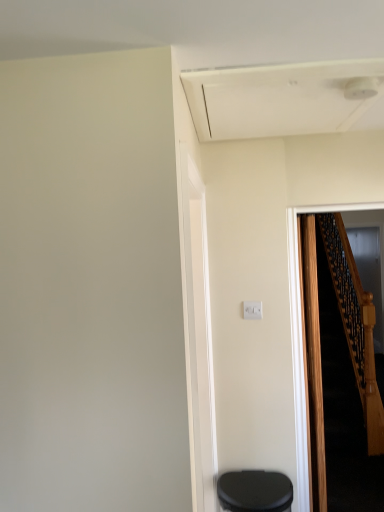
Question: Would you say wooden at right is a long distance from white plastic electric outlet at center?

Choices:
 (A) no
 (B) yes

Answer: (B)

Question: Is wooden at right outside white plastic electric outlet at center?

Choices:
 (A) no
 (B) yes

Answer: (B)

Question: Does wooden at right appear on the right side of white plastic electric outlet at center?

Choices:
 (A) yes
 (B) no

Answer: (A)

Question: Can you confirm if wooden at right is thinner than white plastic electric outlet at center?

Choices:
 (A) no
 (B) yes

Answer: (A)

Question: Does wooden at right turn towards white plastic electric outlet at center?

Choices:
 (A) no
 (B) yes

Answer: (A)

Question: From their relative heights in the image, would you say transparent glass door at right is taller or shorter than black matte trash can at lower right?

Choices:
 (A) short
 (B) tall

Answer: (B)

Question: In terms of width, does transparent glass door at right look wider or thinner when compared to black matte trash can at lower right?

Choices:
 (A) wide
 (B) thin

Answer: (B)

Question: Is transparent glass door at right in front of or behind black matte trash can at lower right in the image?

Choices:
 (A) behind
 (B) front

Answer: (A)

Question: Is transparent glass door at right situated inside black matte trash can at lower right or outside?

Choices:
 (A) inside
 (B) outside

Answer: (B)

Question: From the image's perspective, is wooden at right located above or below black matte trash can at lower right?

Choices:
 (A) above
 (B) below

Answer: (A)

Question: Does point (340, 362) appear closer or farther from the camera than point (281, 502)?

Choices:
 (A) farther
 (B) closer

Answer: (A)

Question: Is wooden at right wider or thinner than black matte trash can at lower right?

Choices:
 (A) wide
 (B) thin

Answer: (B)

Question: Considering the positions of wooden at right and black matte trash can at lower right in the image, is wooden at right taller or shorter than black matte trash can at lower right?

Choices:
 (A) tall
 (B) short

Answer: (A)

Question: Relative to white plastic electric outlet at center, is black matte trash can at lower right in front or behind?

Choices:
 (A) front
 (B) behind

Answer: (A)

Question: Choose the correct answer: Is black matte trash can at lower right inside white plastic electric outlet at center or outside it?

Choices:
 (A) outside
 (B) inside

Answer: (A)